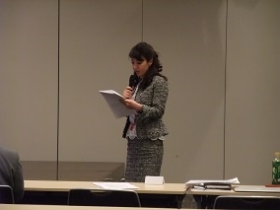
Identify the location of wall. Image resolution: width=280 pixels, height=210 pixels. (204, 81).